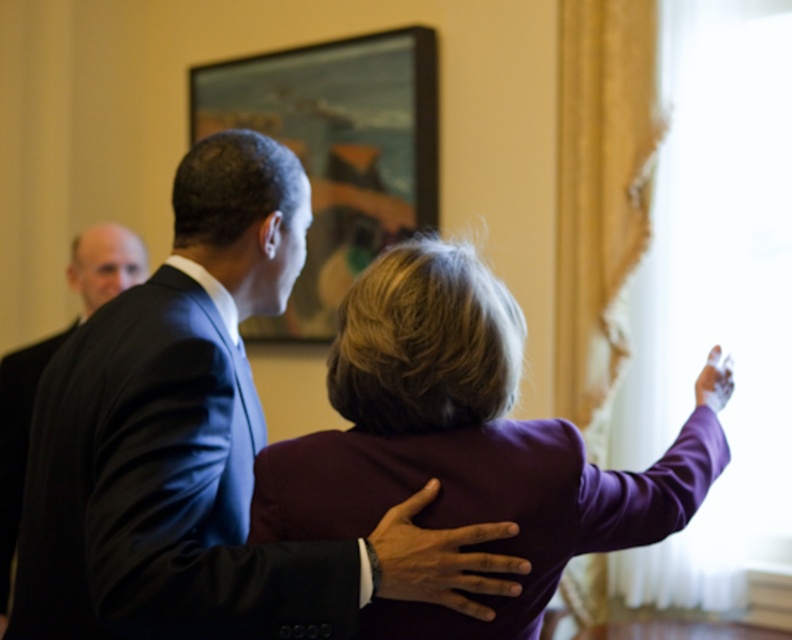
You are a photographer setting up for an event. You need to position a spotlight so it illuminates both the dark blue smooth suit at center and the purple fabric coat at upper center without overlapping their light areas. Given their positions, which object should the spotlight be placed closer to?

The dark blue smooth suit at center is in front of the purple fabric coat at upper center, so the spotlight should be placed closer to the dark blue smooth suit at center to ensure both are illuminated without overlapping light areas.

You are standing in the room and need to locate the dark blue smooth suit at center and the purple fabric coat at upper center. Which one is positioned to the left side of the other?

The dark blue smooth suit at center is to the left of the purple fabric coat at upper center.

Consider the image. You are a photographer trying to capture a candid shot of the two main subjects in the scene. The purple fabric coat at upper center and wooden frame at upper center are both in your camera frame. If you want to adjust your camera to focus on both objects clearly, what is the minimum distance you need to set between the nearest and farthest points your camera should focus on?

The purple fabric coat at upper center and wooden frame at upper center are 6.86 feet apart, so you need to set the focus range to at least 6.86 feet to ensure both are in clear focus.